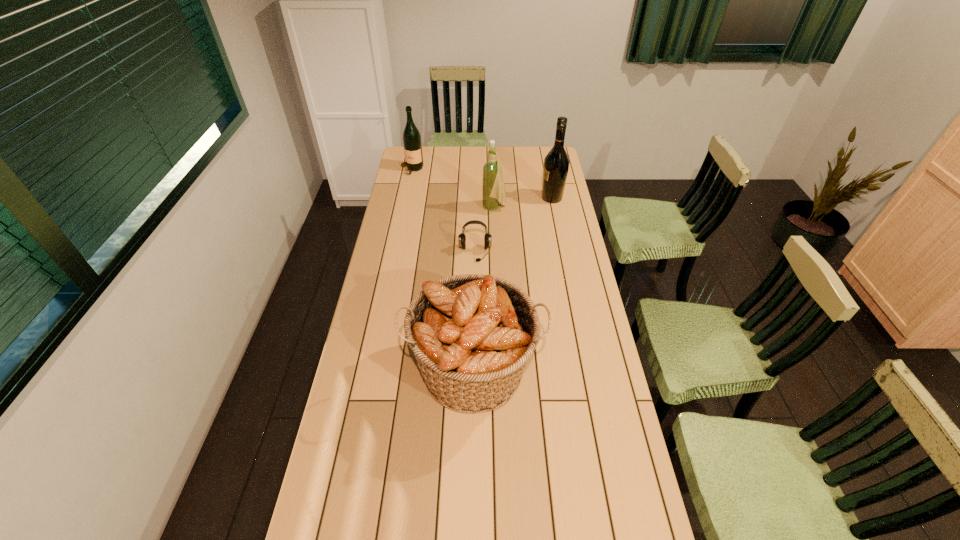
In order to click on object that is at the far left corner in this screenshot , I will do `click(412, 143)`.

You are a GUI agent. You are given a task and a screenshot of the screen. Output one action in this format:
    pyautogui.click(x=<x>, y=<y>)
    Task: Click on the blank space at the far edge of the desktop
    
    Given the screenshot: What is the action you would take?
    (x=457, y=146)

Locate an element on the screen. This screenshot has height=540, width=960. free spot at the left edge of the desktop is located at coordinates (426, 199).

Identify the location of free region at the right edge of the desktop. (590, 400).

Identify the location of vacant space at the far left corner. (424, 164).

Where is `empty space that is in between the farthest wine bottle and the headset`? empty space that is in between the farthest wine bottle and the headset is located at coordinates (444, 211).

In order to click on free space between the farthest wine bottle and the tallest wine bottle in this screenshot , I will do `click(482, 184)`.

Locate an element on the screen. This screenshot has width=960, height=540. empty location between the second wine bottle from left to right and the rightmost object is located at coordinates (523, 203).

Image resolution: width=960 pixels, height=540 pixels. What are the coordinates of `vacant region between the headset and the rightmost object` in the screenshot? It's located at click(514, 226).

Where is `unoccupied position between the second wine bottle from left to right and the farthest wine bottle`? The height and width of the screenshot is (540, 960). unoccupied position between the second wine bottle from left to right and the farthest wine bottle is located at coordinates (453, 189).